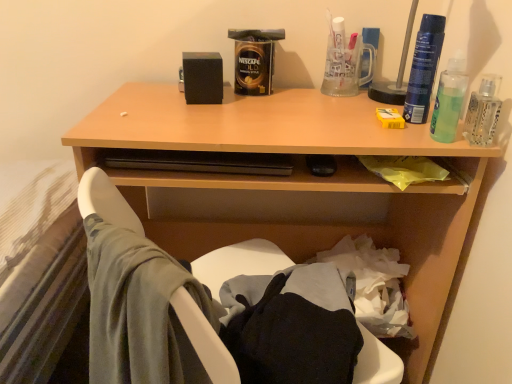
Locate an element on the screen. unoccupied space behind green translucent liquid at upper right is located at coordinates (404, 111).